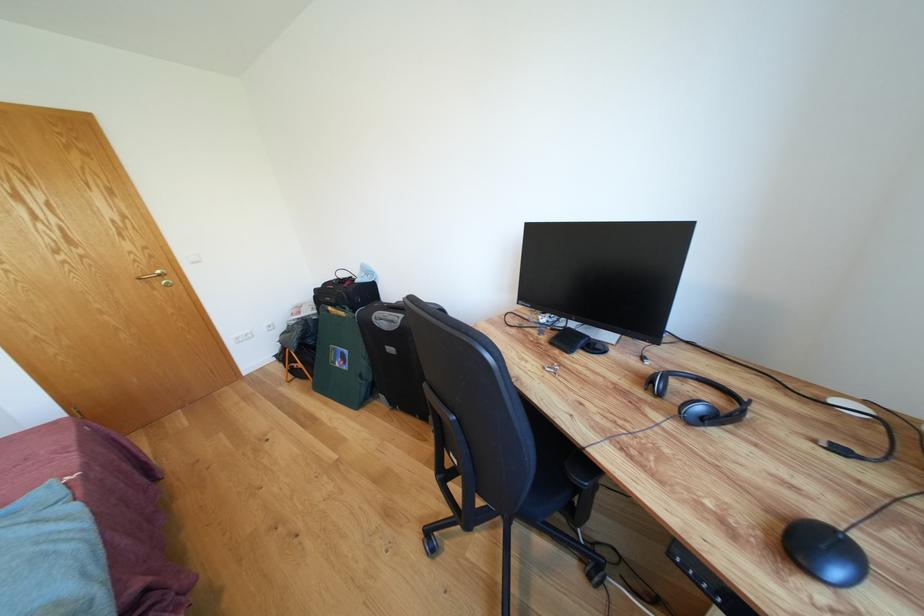
What do you see at coordinates (582, 485) in the screenshot?
I see `the chair armrest` at bounding box center [582, 485].